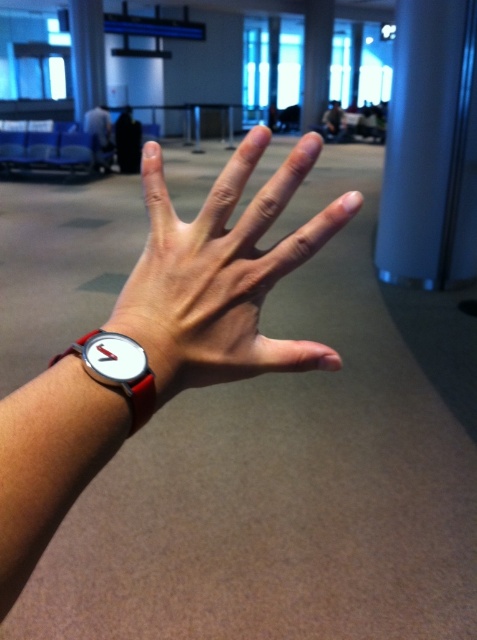
You are a jeweler examining the image to determine if the white leather watch at center can fit into a display case designed for items narrower than the satin blue pillar at right. Based on the scene, can the watch fit?

The white leather watch at center has a width less than the satin blue pillar at right, so it can fit into the display case designed for items narrower than the satin blue pillar at right.

You are a jeweler examining two watches in the scene. The white leather watch at center and the matte black watch at lower left. Which one has a larger width?

The white leather watch at center might be wider than matte black watch at lower left.